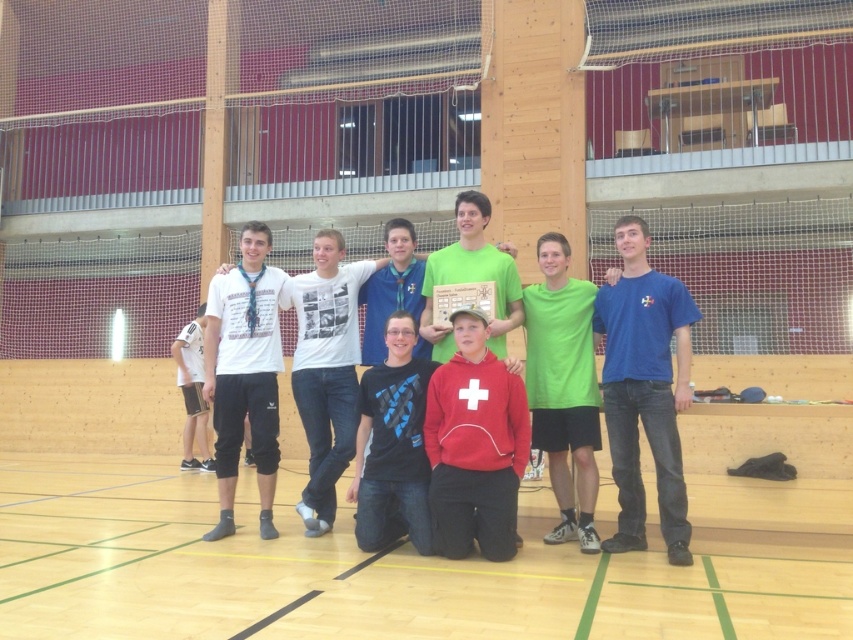
Question: Is red matte sweatshirt at center thinner than green matte t-shirt at center?

Choices:
 (A) yes
 (B) no

Answer: (B)

Question: Is wooden floor at lower center thinner than red matte sweatshirt at center?

Choices:
 (A) no
 (B) yes

Answer: (A)

Question: Considering the real-world distances, which object is closest to the red matte sweatshirt at center?

Choices:
 (A) green matte t-shirt at center
 (B) blue cotton t-shirt at right
 (C) wooden floor at lower center
 (D) metallic plaque at center

Answer: (D)

Question: Is wooden floor at lower center thinner than red matte sweatshirt at center?

Choices:
 (A) yes
 (B) no

Answer: (B)

Question: Estimate the real-world distances between objects in this image. Which object is farther from the metallic plaque at center?

Choices:
 (A) red matte sweatshirt at center
 (B) wooden floor at lower center

Answer: (B)

Question: Which object is closer to the camera taking this photo?

Choices:
 (A) metallic plaque at center
 (B) red matte sweatshirt at center

Answer: (B)